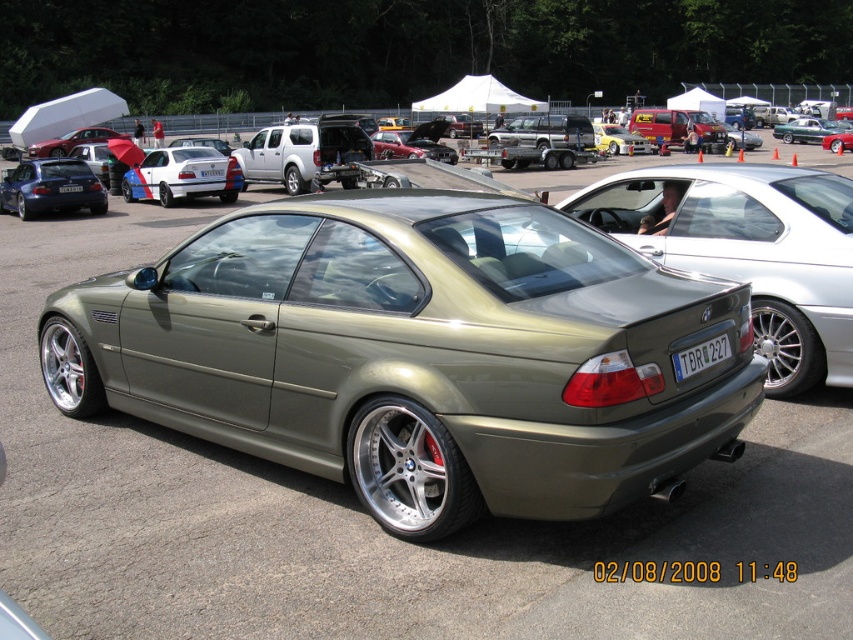
Question: Does white plastic license plate at center have a smaller size compared to white plastic license plate at rear?

Choices:
 (A) no
 (B) yes

Answer: (A)

Question: Observing the image, what is the correct spatial positioning of matte black car at left in reference to blue plastic license plate at rear?

Choices:
 (A) left
 (B) right

Answer: (A)

Question: Which of the following is the farthest from the observer?

Choices:
 (A) tap(287, 189)
 (B) tap(138, 268)
 (C) tap(701, 349)

Answer: (A)

Question: Which object is farther from the camera taking this photo?

Choices:
 (A) matte black car at left
 (B) white plastic license plate at center
 (C) metallic green car at center

Answer: (B)

Question: Which point appears closest to the camera in this image?

Choices:
 (A) (357, 182)
 (B) (131, 285)

Answer: (B)

Question: Can you confirm if matte black car at left is smaller than white plastic license plate at rear?

Choices:
 (A) yes
 (B) no

Answer: (B)